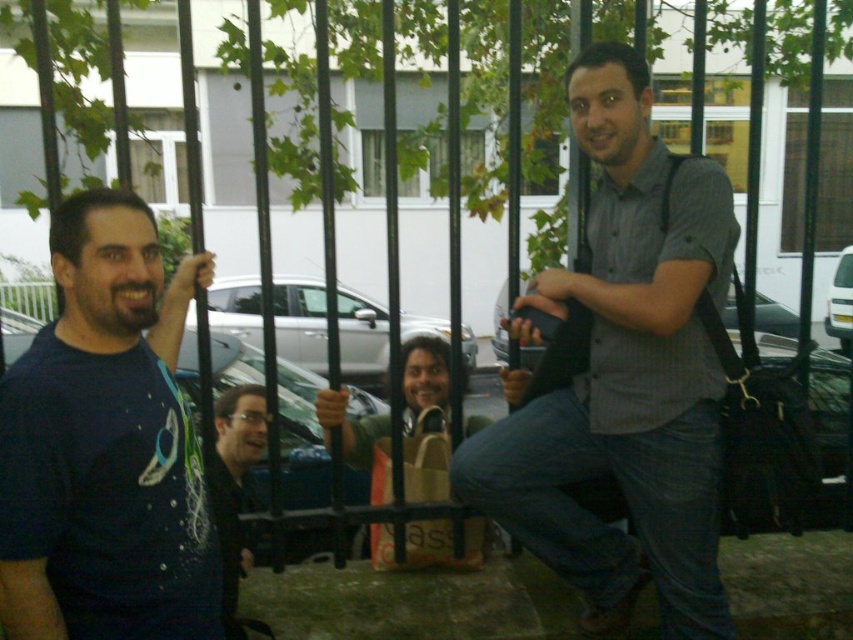
Question: Where is gray checkered shirt at center located in relation to matte black glasses at center in the image?

Choices:
 (A) below
 (B) above

Answer: (B)

Question: Which of the following is the closest to the observer?

Choices:
 (A) dark blue t-shirt at left
 (B) matte black glasses at center
 (C) gray checkered shirt at center

Answer: (A)

Question: Which point is farther from the camera taking this photo?

Choices:
 (A) (135, 403)
 (B) (534, 449)

Answer: (B)

Question: Which object is closer to the camera taking this photo?

Choices:
 (A) dark blue t-shirt at left
 (B) matte black glasses at center
 (C) gray checkered shirt at center

Answer: (A)

Question: Can you confirm if gray checkered shirt at center is wider than matte black glasses at center?

Choices:
 (A) yes
 (B) no

Answer: (A)

Question: Is gray checkered shirt at center to the right of dark blue t-shirt at left from the viewer's perspective?

Choices:
 (A) yes
 (B) no

Answer: (A)